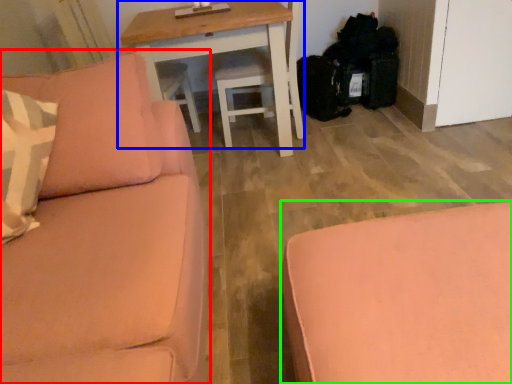
Question: Based on their relative distances, which object is nearer to studio couch (highlighted by a red box)? Choose from table (highlighted by a blue box) and studio couch (highlighted by a green box).

Choices:
 (A) table
 (B) studio couch

Answer: (B)